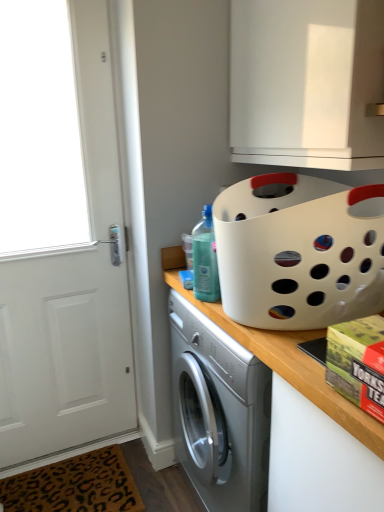
Question: Is white matte door at left smaller than brown leopard print mat at lower left?

Choices:
 (A) yes
 (B) no

Answer: (B)

Question: From the image's perspective, is white matte door at left below brown leopard print mat at lower left?

Choices:
 (A) no
 (B) yes

Answer: (A)

Question: Considering the relative sizes of white matte door at left and brown leopard print mat at lower left in the image provided, is white matte door at left taller than brown leopard print mat at lower left?

Choices:
 (A) yes
 (B) no

Answer: (A)

Question: Can you confirm if white matte door at left is thinner than brown leopard print mat at lower left?

Choices:
 (A) yes
 (B) no

Answer: (A)

Question: Can you confirm if white matte door at left is positioned to the left of brown leopard print mat at lower left?

Choices:
 (A) no
 (B) yes

Answer: (B)

Question: Does white matte door at left have a larger size compared to brown leopard print mat at lower left?

Choices:
 (A) yes
 (B) no

Answer: (A)

Question: Is white matte door at left to the right of white matte cabinet at upper center from the viewer's perspective?

Choices:
 (A) no
 (B) yes

Answer: (A)

Question: Does white matte door at left have a lesser width compared to white matte cabinet at upper center?

Choices:
 (A) no
 (B) yes

Answer: (B)

Question: Is white matte door at left shorter than white matte cabinet at upper center?

Choices:
 (A) yes
 (B) no

Answer: (B)

Question: Is white matte door at left taller than white matte cabinet at upper center?

Choices:
 (A) yes
 (B) no

Answer: (A)

Question: Is white matte door at left outside white matte cabinet at upper center?

Choices:
 (A) yes
 (B) no

Answer: (A)

Question: From the image's perspective, is white matte door at left on top of white matte cabinet at upper center?

Choices:
 (A) yes
 (B) no

Answer: (B)

Question: Does white plastic basket at upper right lie in front of white matte door at left?

Choices:
 (A) no
 (B) yes

Answer: (B)